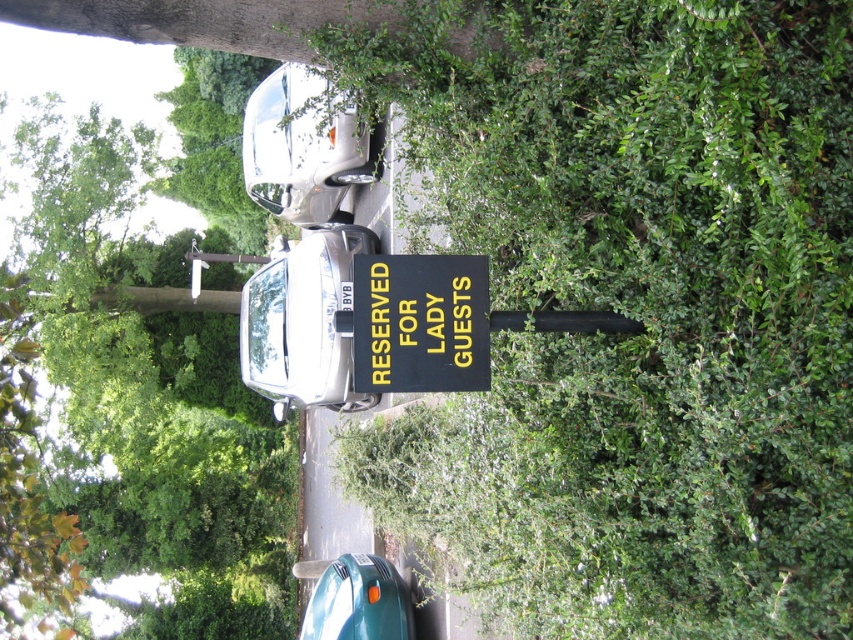
Question: Does silver metallic car at upper center appear on the left side of teal matte car at lower center?

Choices:
 (A) yes
 (B) no

Answer: (A)

Question: Can you confirm if satin silver car at center is wider than silver metallic car at upper center?

Choices:
 (A) no
 (B) yes

Answer: (B)

Question: Is satin silver car at center smaller than teal matte car at lower center?

Choices:
 (A) yes
 (B) no

Answer: (B)

Question: Which of the following is the closest to the observer?

Choices:
 (A) (339, 628)
 (B) (270, 284)
 (C) (459, 272)

Answer: (C)

Question: Which object appears closest to the camera in this image?

Choices:
 (A) black/yellow plastic sign at center
 (B) silver metallic car at upper center

Answer: (A)

Question: Which point is closer to the camera?

Choices:
 (A) satin silver car at center
 (B) black/yellow plastic sign at center
 (C) teal matte car at lower center
 (D) silver metallic car at upper center

Answer: (B)